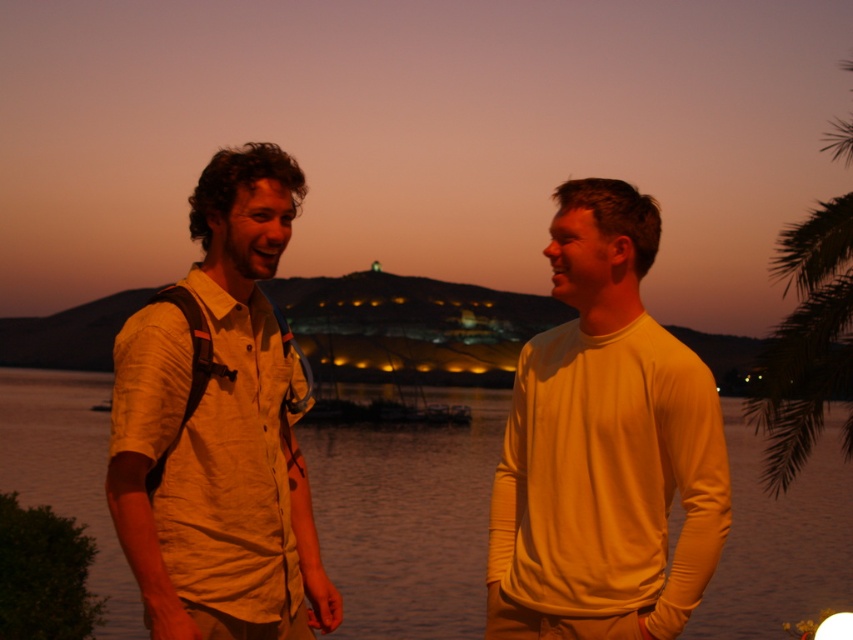
Question: Which of these objects is positioned closest to the green leafy palm tree at right?

Choices:
 (A) beige cotton shirt at center
 (B) matte yellow water at center

Answer: (A)

Question: Among these points, which one is farthest from the camera?

Choices:
 (A) (440, 582)
 (B) (161, 346)

Answer: (A)

Question: Which object appears closest to the camera in this image?

Choices:
 (A) beige cotton shirt at left
 (B) matte yellow water at center

Answer: (A)

Question: Does beige cotton shirt at center have a larger size compared to green leafy palm tree at right?

Choices:
 (A) yes
 (B) no

Answer: (B)

Question: Can you confirm if matte yellow water at center is positioned above beige cotton shirt at left?

Choices:
 (A) no
 (B) yes

Answer: (A)

Question: Is beige cotton shirt at center smaller than matte yellow water at center?

Choices:
 (A) no
 (B) yes

Answer: (B)